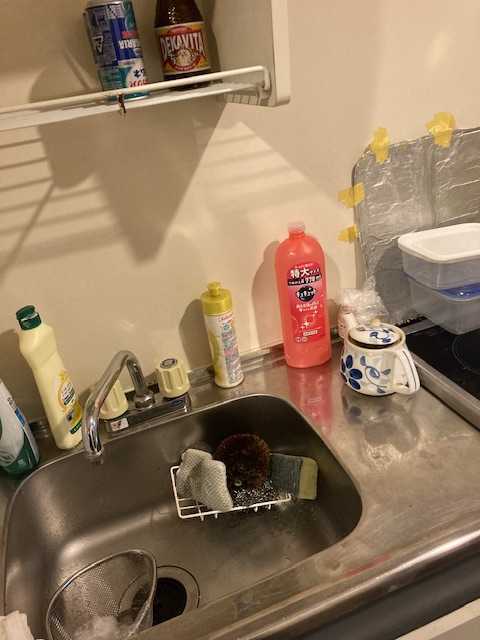
You are a GUI agent. You are given a task and a screenshot of the screen. Output one action in this format:
    pyautogui.click(x=<x>, y=<y>)
    Task: Click on the sponge
    
    Given the screenshot: What is the action you would take?
    pyautogui.click(x=303, y=484)